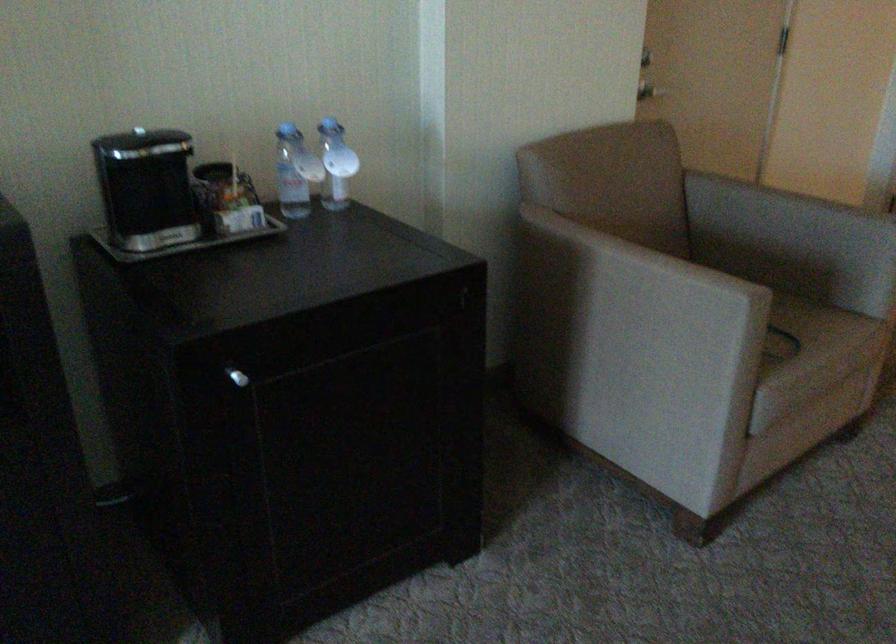
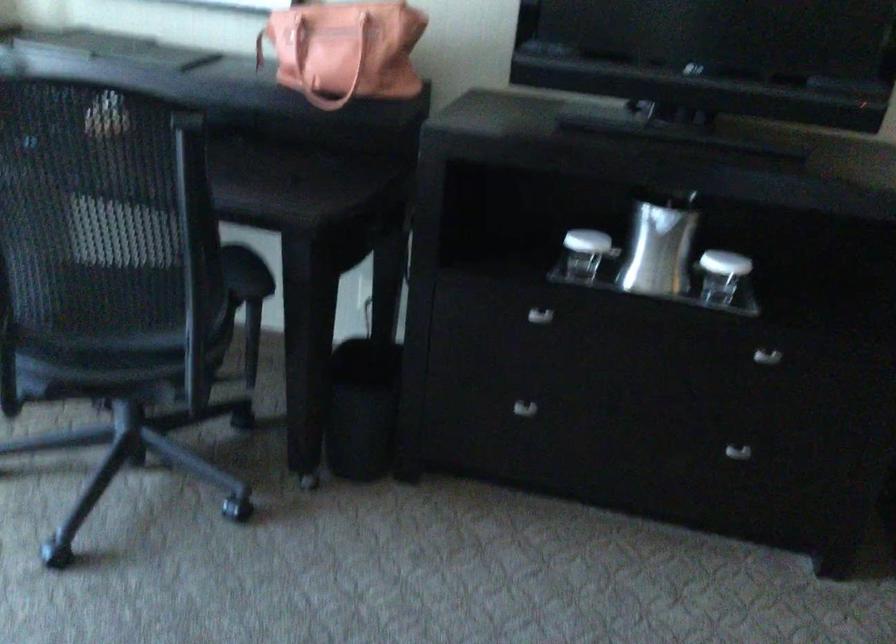
Question: The camera is either moving clockwise (left) or counter-clockwise (right) around the object. The first image is from the beginning of the video and the second image is from the end. Is the camera moving left or right when shooting the video?

Choices:
 (A) Left
 (B) Right

Answer: (B)